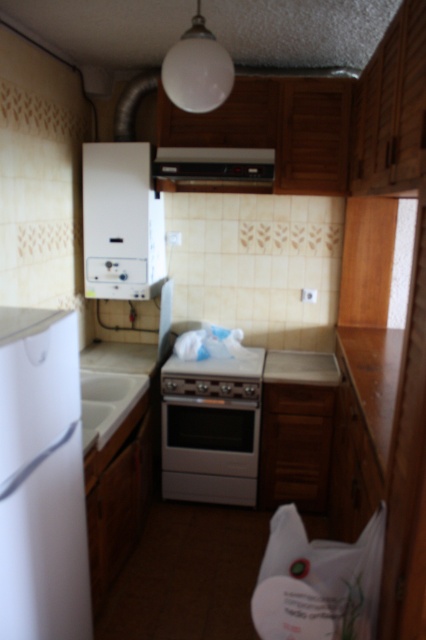
Consider the image. Who is more forward, (175,413) or (215,156)?

Point (215,156) is more forward.

Between white glossy oven at center and black matte exhaust hood at upper center, which one has more height?

Standing taller between the two is white glossy oven at center.

Which is in front, point (253, 433) or point (215, 148)?

Point (215, 148) is in front.

Image resolution: width=426 pixels, height=640 pixels. What are the coordinates of `white glossy oven at center` in the screenshot? It's located at (212, 428).

Can you confirm if white glossy boiler at upper left is taller than black matte exhaust hood at upper center?

Yes.

Between white glossy boiler at upper left and black matte exhaust hood at upper center, which one is positioned lower?

white glossy boiler at upper left is below.

The height and width of the screenshot is (640, 426). Describe the element at coordinates (120, 221) in the screenshot. I see `white glossy boiler at upper left` at that location.

This screenshot has height=640, width=426. What are the coordinates of `white glossy boiler at upper left` in the screenshot? It's located at (120, 221).

Can you confirm if white glossy oven at center is positioned to the right of wooden at right?

No, white glossy oven at center is not to the right of wooden at right.

Between white glossy oven at center and wooden at right, which one has less height?

wooden at right

Is point (215, 419) less distant than point (347, 337)?

Yes.

Locate an element on the screen. white glossy oven at center is located at coordinates (212, 428).